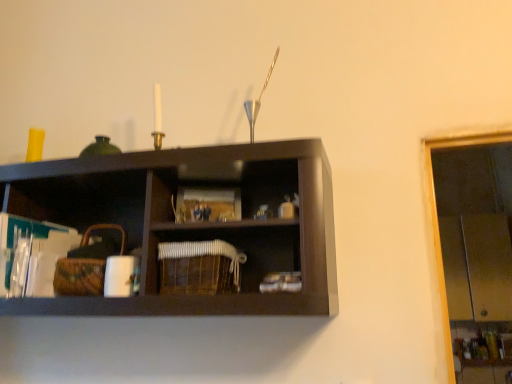
Question: Should I look upward or downward to see woven brown basket at left, the first basket positioned from the left?

Choices:
 (A) down
 (B) up

Answer: (A)

Question: Is woven brown basket at left, the second basket positioned from the right, located outside woven brown basket at center, the 2th basket in the left-to-right sequence?

Choices:
 (A) yes
 (B) no

Answer: (A)

Question: Does woven brown basket at left, the first basket positioned from the left, appear on the left side of woven brown basket at center, the 1th basket positioned from the right?

Choices:
 (A) yes
 (B) no

Answer: (A)

Question: From a real-world perspective, is woven brown basket at left, the second basket positioned from the right, beneath woven brown basket at center, the 1th basket positioned from the right?

Choices:
 (A) yes
 (B) no

Answer: (B)

Question: Can woven brown basket at center, the 2th basket in the left-to-right sequence, be found inside woven brown basket at left, the second basket positioned from the right?

Choices:
 (A) yes
 (B) no

Answer: (B)

Question: Is woven brown basket at left, the second basket positioned from the right, at the right side of woven brown basket at center, the 2th basket in the left-to-right sequence?

Choices:
 (A) no
 (B) yes

Answer: (A)

Question: Is woven brown basket at left, the second basket positioned from the right, shorter than woven brown basket at center, the 2th basket in the left-to-right sequence?

Choices:
 (A) yes
 (B) no

Answer: (B)

Question: Does woven brown basket at center, the 2th basket in the left-to-right sequence, have a greater height compared to woven brown basket at left, the first basket positioned from the left?

Choices:
 (A) yes
 (B) no

Answer: (B)

Question: Considering the relative positions of woven brown basket at center, the 1th basket positioned from the right, and woven brown basket at left, the second basket positioned from the right, in the image provided, is woven brown basket at center, the 1th basket positioned from the right, behind woven brown basket at left, the second basket positioned from the right,?

Choices:
 (A) no
 (B) yes

Answer: (A)

Question: From the image's perspective, is woven brown basket at center, the 2th basket in the left-to-right sequence, located beneath woven brown basket at left, the second basket positioned from the right?

Choices:
 (A) no
 (B) yes

Answer: (B)

Question: Is woven brown basket at center, the 1th basket positioned from the right, completely or partially outside of woven brown basket at left, the first basket positioned from the left?

Choices:
 (A) yes
 (B) no

Answer: (A)

Question: Is woven brown basket at center, the 1th basket positioned from the right, thinner than woven brown basket at left, the first basket positioned from the left?

Choices:
 (A) no
 (B) yes

Answer: (A)

Question: Considering the relative positions of woven brown basket at center, the 2th basket in the left-to-right sequence, and woven brown basket at left, the second basket positioned from the right, in the image provided, is woven brown basket at center, the 2th basket in the left-to-right sequence, to the left of woven brown basket at left, the second basket positioned from the right, from the viewer's perspective?

Choices:
 (A) no
 (B) yes

Answer: (A)

Question: Is point (96, 268) closer or farther from the camera than point (196, 253)?

Choices:
 (A) closer
 (B) farther

Answer: (B)